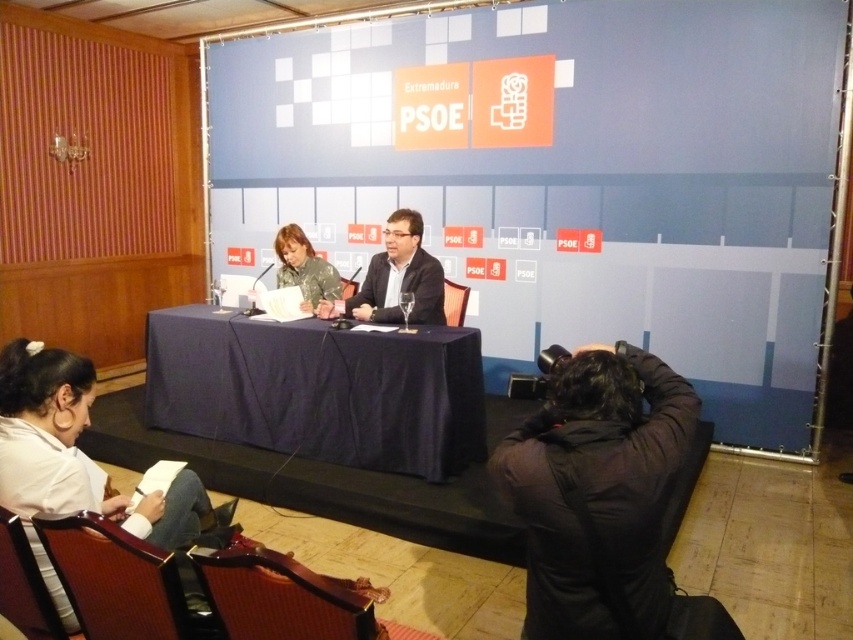
From the picture: Who is lower down, white fabric shirt at lower left or camouflage fabric shirt at center?

white fabric shirt at lower left

Which is more to the right, white fabric shirt at lower left or camouflage fabric shirt at center?

camouflage fabric shirt at center

Is point (82, 476) farther from camera compared to point (338, 289)?

That is False.

Locate an element on the screen. white fabric shirt at lower left is located at coordinates (73, 460).

Which of these two, dark blue fabric table at center or camouflage fabric shirt at center, stands taller?

dark blue fabric table at center is taller.

Between point (294, 420) and point (325, 292), which one is positioned behind?

Positioned behind is point (325, 292).

At what (x,y) coordinates should I click in order to perform the action: click on dark blue fabric table at center. Please return your answer as a coordinate pair (x, y). The width and height of the screenshot is (853, 640). Looking at the image, I should click on (318, 388).

Who is more forward, (x=370, y=280) or (x=300, y=250)?

Point (x=370, y=280) is in front.

Which is more to the right, camouflage-patterned shirt at center or camouflage fabric shirt at center?

camouflage-patterned shirt at center

Is point (375, 308) positioned after point (281, 266)?

No, it is not.

Locate an element on the screen. The image size is (853, 640). camouflage-patterned shirt at center is located at coordinates (399, 276).